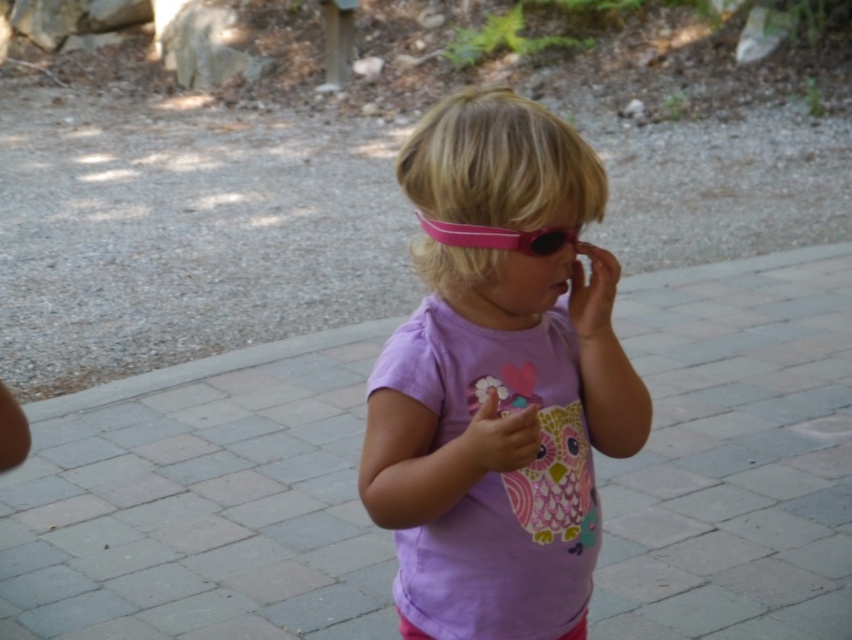
You are a delivery drone that needs to land on the gray brick pavement at center. Your landing gear is 1 meter tall. Can you safely land without damaging the purple matte shirt at center?

The gray brick pavement at center is taller than the purple matte shirt at center. Since the landing gear is 1 meter tall, it may clear the purple matte shirt at center if the pavement is elevated enough. However, without knowing the exact height difference, we cannot confirm safety. Please verify the height difference before landing.

You are a small toy car that is 10 cm wide. You want to drive from the gray brick pavement at center to the pink rubber goggles at center. Is there enough space for you to move between them?

The gray brick pavement at center is wider than the pink rubber goggles at center, so there is enough space for the toy car to move between them since the pavement is wider than the goggles.